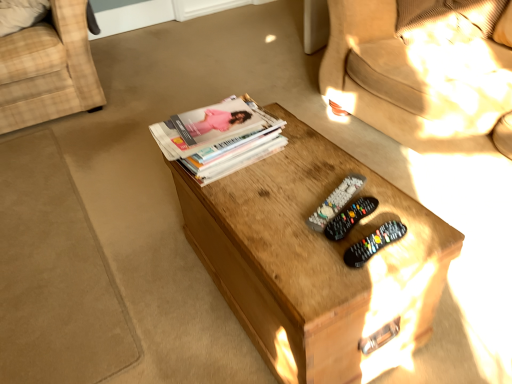
Question: Considering the relative sizes of black plastic remote control at center, the 2th remote control positioned from the front, and plaid fabric chair at left in the image provided, is black plastic remote control at center, the 2th remote control positioned from the front, smaller than plaid fabric chair at left?

Choices:
 (A) no
 (B) yes

Answer: (B)

Question: Is black plastic remote control at center, marked as the second remote control in a back-to-front arrangement, oriented towards plaid fabric chair at left?

Choices:
 (A) yes
 (B) no

Answer: (B)

Question: From a real-world perspective, is black plastic remote control at center, the 2th remote control positioned from the front, physically above plaid fabric chair at left?

Choices:
 (A) yes
 (B) no

Answer: (A)

Question: Considering the relative sizes of black plastic remote control at center, the 2th remote control positioned from the front, and plaid fabric chair at left in the image provided, is black plastic remote control at center, the 2th remote control positioned from the front, bigger than plaid fabric chair at left?

Choices:
 (A) yes
 (B) no

Answer: (B)

Question: Is black plastic remote control at center, the 2th remote control positioned from the front, turned away from plaid fabric chair at left?

Choices:
 (A) no
 (B) yes

Answer: (A)

Question: In terms of size, does white glossy magazine stack at center appear bigger or smaller than black plastic remote at center, marked as the 1th remote control in a back-to-front arrangement?

Choices:
 (A) small
 (B) big

Answer: (B)

Question: From a real-world perspective, is white glossy magazine stack at center physically located above or below black plastic remote at center, which is the 3th remote control from front to back?

Choices:
 (A) below
 (B) above

Answer: (B)

Question: Is white glossy magazine stack at center spatially inside black plastic remote at center, which is the 3th remote control from front to back, or outside of it?

Choices:
 (A) inside
 (B) outside

Answer: (B)

Question: Considering the positions of point pyautogui.click(x=202, y=175) and point pyautogui.click(x=354, y=173), is point pyautogui.click(x=202, y=175) closer or farther from the camera than point pyautogui.click(x=354, y=173)?

Choices:
 (A) farther
 (B) closer

Answer: (A)

Question: From the image's perspective, relative to black plastic remote at center, marked as the 1th remote control in a back-to-front arrangement, is black plastic remote controls at center, acting as the third remote control starting from the back, above or below?

Choices:
 (A) above
 (B) below

Answer: (B)

Question: Is black plastic remote controls at center, acting as the third remote control starting from the back, to the left or to the right of black plastic remote at center, which is the 3th remote control from front to back, in the image?

Choices:
 (A) left
 (B) right

Answer: (B)

Question: In terms of width, does black plastic remote controls at center, which ranks as the first remote control in front-to-back order, look wider or thinner when compared to black plastic remote at center, which is the 3th remote control from front to back?

Choices:
 (A) wide
 (B) thin

Answer: (B)

Question: From a real-world perspective, is black plastic remote controls at center, acting as the third remote control starting from the back, positioned above or below black plastic remote at center, marked as the 1th remote control in a back-to-front arrangement?

Choices:
 (A) above
 (B) below

Answer: (A)

Question: Is white glossy magazine stack at center situated inside wooden coffee table at center or outside?

Choices:
 (A) inside
 (B) outside

Answer: (B)

Question: In the image, is white glossy magazine stack at center positioned in front of or behind wooden coffee table at center?

Choices:
 (A) front
 (B) behind

Answer: (B)